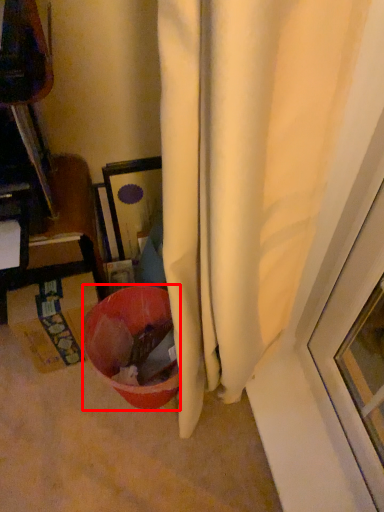
Question: From the image's perspective, what is the correct spatial relationship of bowl (annotated by the red box) in relation to cardboard box?

Choices:
 (A) below
 (B) above

Answer: (A)